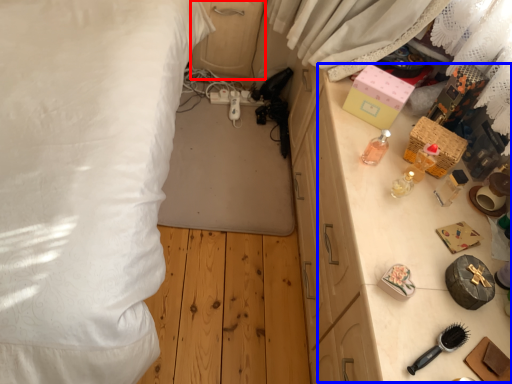
Question: Which of the following is the farthest to the observer, dresser (highlighted by a red box) or table (highlighted by a blue box)?

Choices:
 (A) dresser
 (B) table

Answer: (A)